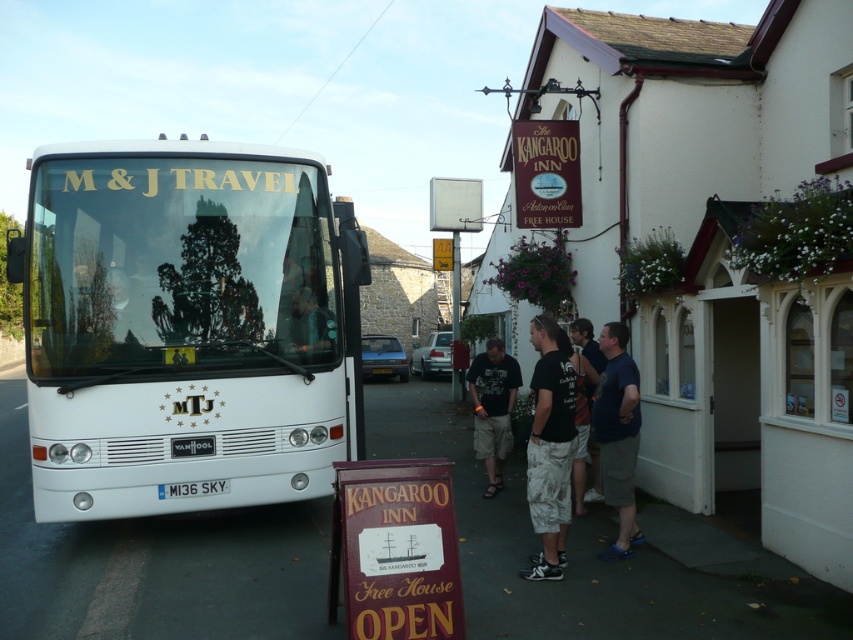
You are standing in front of The Kangaroo Inn pub and want to reach a specific point marked at coordinates point (561,404). The pub has a white coach bus parked in front of it. Can you walk around the bus to reach the point without going through the bus itself?

The distance of point (561,404) from viewer is 19.75 feet. Since the bus is parked in front of the pub, you can walk around it to reach the point as long as there is enough space around the bus. However, the exact feasibility depends on the bus dimensions and the available path, which are not provided here.